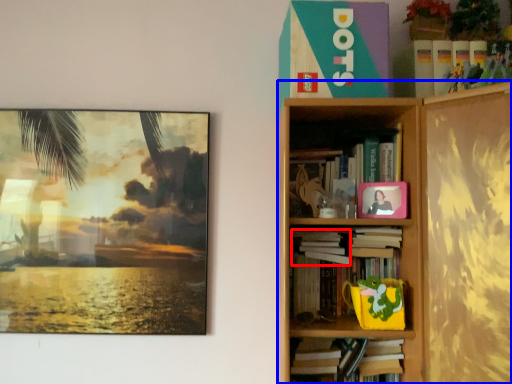
Question: Which object appears closest to the camera in this image, book (highlighted by a red box) or bookcase (highlighted by a blue box)?

Choices:
 (A) book
 (B) bookcase

Answer: (B)